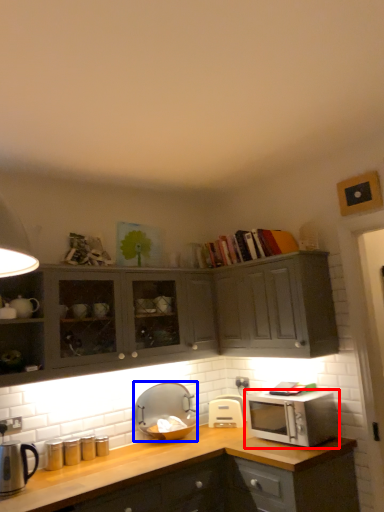
Question: Which point is further to the camera, microwave oven (highlighted by a red box) or appliance (highlighted by a blue box)?

Choices:
 (A) microwave oven
 (B) appliance

Answer: (B)